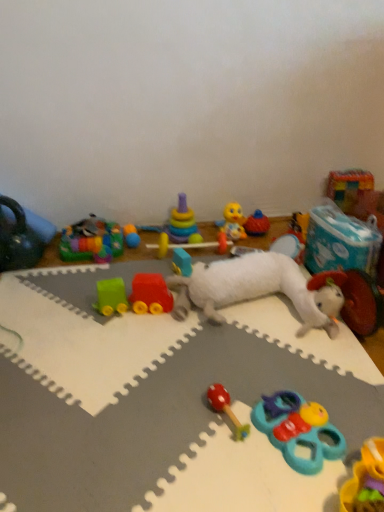
You are a GUI agent. You are given a task and a screenshot of the screen. Output one action in this format:
    pyautogui.click(x=<x>, y=<y>)
    Task: Click on the vacant area that lies between white plush lamb at center, the 13th toy viewed from the left, and smooth red wooden rattle at center, the 9th toy in the right-to-left sequence
    The width and height of the screenshot is (384, 512).
    Given the screenshot: What is the action you would take?
    click(257, 343)